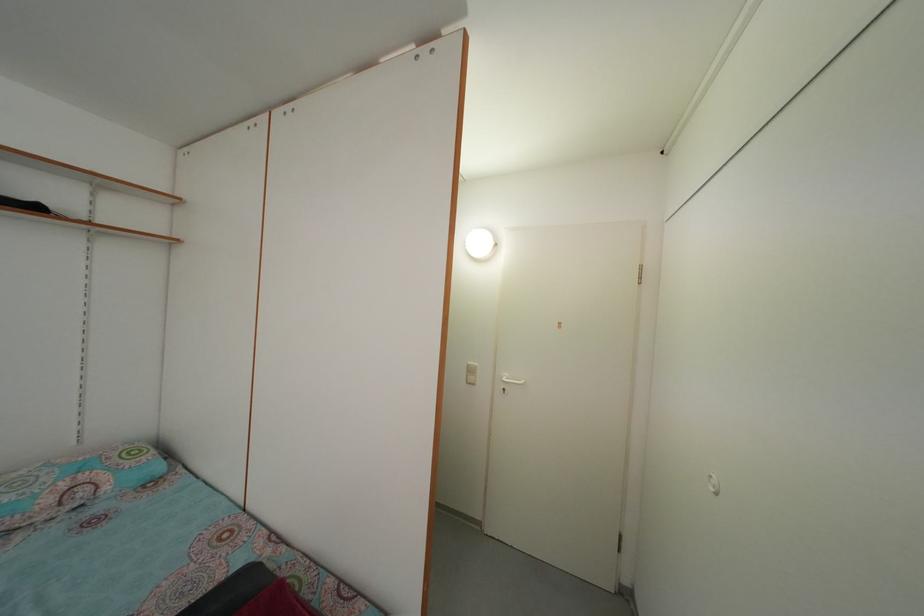
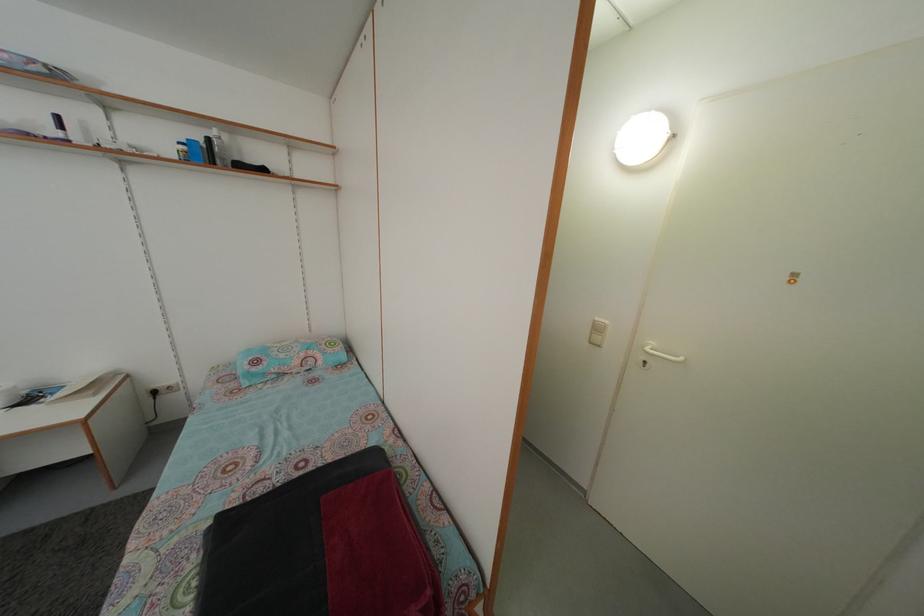
Question: How did the camera likely rotate?

Choices:
 (A) Left
 (B) Right
 (C) Up
 (D) Down

Answer: (A)